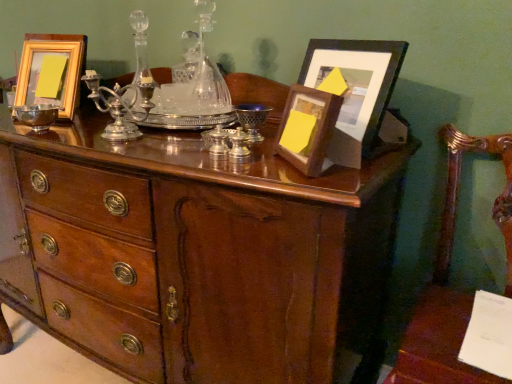
At what (x,y) coordinates should I click in order to perform the action: click on free location in front of shiny silver bowl at left. Please return your answer as a coordinate pair (x, y). This screenshot has width=512, height=384. Looking at the image, I should click on tap(35, 138).